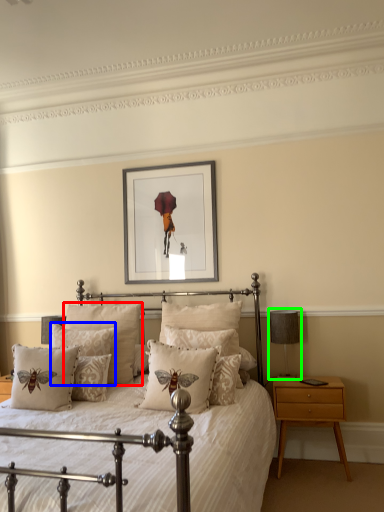
Question: Which object is the closest to the pillow (highlighted by a red box)? Choose among these: pillow (highlighted by a blue box) or table lamp (highlighted by a green box).

Choices:
 (A) pillow
 (B) table lamp

Answer: (A)